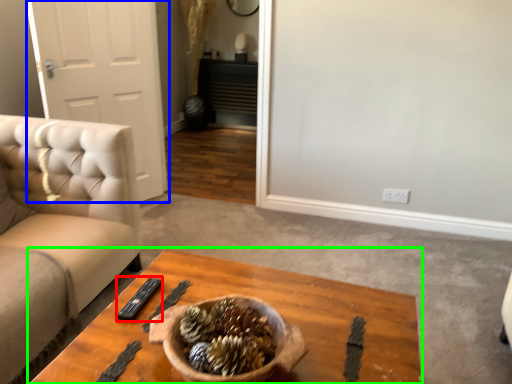
Question: Which is farther away from remote (highlighted by a red box)? door (highlighted by a blue box) or coffee table (highlighted by a green box)?

Choices:
 (A) door
 (B) coffee table

Answer: (A)